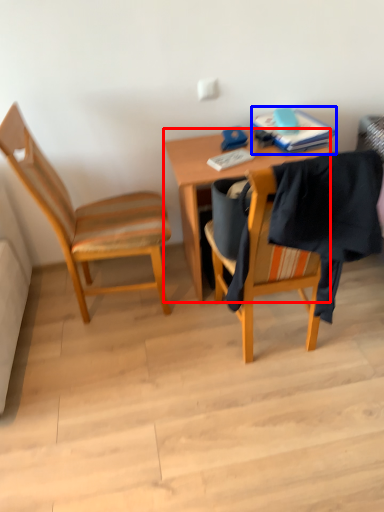
Question: Which object appears closest to the camera in this image, desk (highlighted by a red box) or book (highlighted by a blue box)?

Choices:
 (A) desk
 (B) book

Answer: (A)